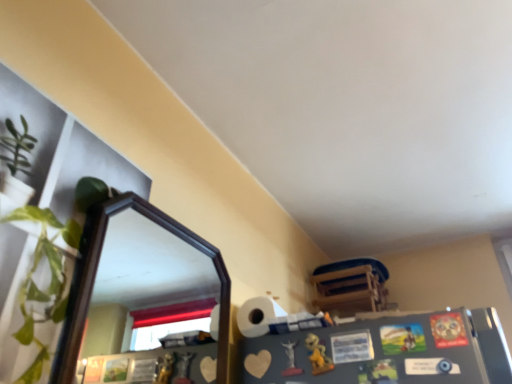
Question: Considering the positions of yellow matte toy at lower center, acting as the second toy starting from the left, and wooden chair at upper right in the image, is yellow matte toy at lower center, acting as the second toy starting from the left, wider or thinner than wooden chair at upper right?

Choices:
 (A) wide
 (B) thin

Answer: (B)

Question: Considering the positions of yellow matte toy at lower center, placed as the first toy when sorted from right to left, and wooden chair at upper right in the image, is yellow matte toy at lower center, placed as the first toy when sorted from right to left, taller or shorter than wooden chair at upper right?

Choices:
 (A) tall
 (B) short

Answer: (B)

Question: Which object is the closest to the matte plastic statue at lower center, marked as the first toy in a left-to-right arrangement?

Choices:
 (A) wooden chair at upper right
 (B) black wooden mirror at upper left
 (C) yellow matte toy at lower center, placed as the first toy when sorted from right to left

Answer: (C)

Question: Which is nearer to the wooden chair at upper right?

Choices:
 (A) black wooden mirror at upper left
 (B) yellow matte toy at lower center, placed as the first toy when sorted from right to left
 (C) matte plastic statue at lower center, positioned as the second toy in right-to-left order

Answer: (C)